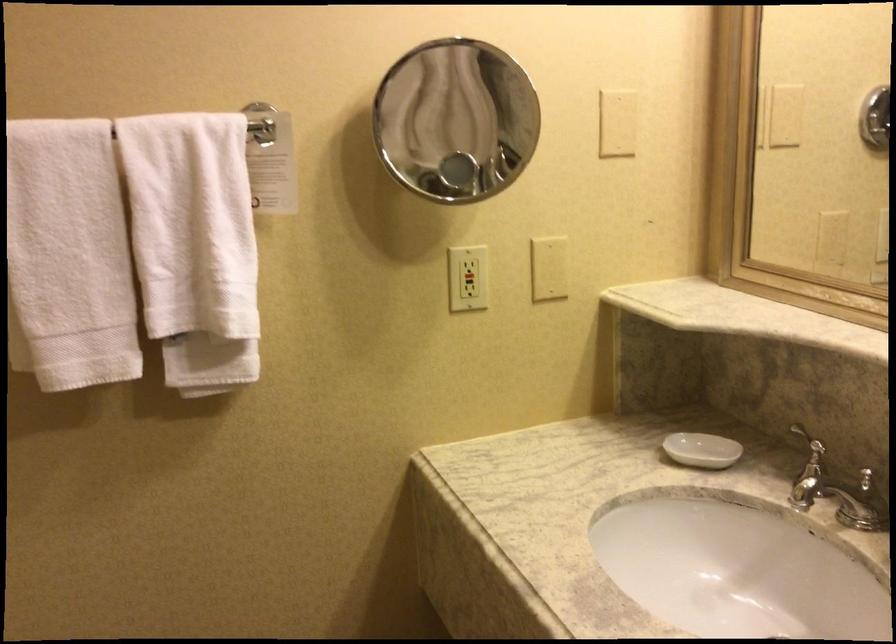
Which object does [702,450] point to?

It corresponds to the white soap dish in the image.